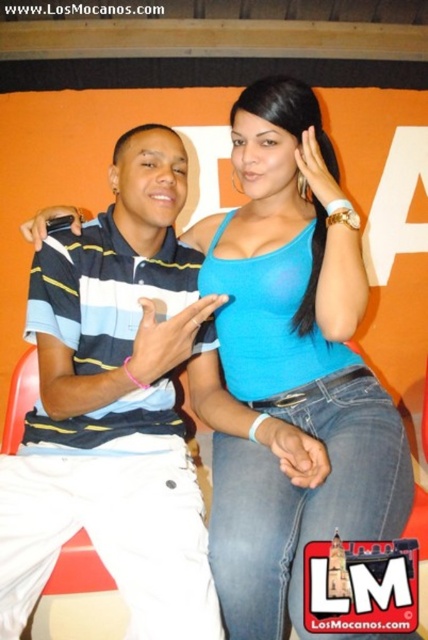
You are standing in front of the image and want to identify the position of the striped cotton polo shirt at center. Based on the coordinates provided, can you determine if it is positioned more to the left or right side of the image?

The striped cotton polo shirt at center is located at coordinates point (115, 406). Since the x coordinate is 0.636 which is closer to 1.0, it is positioned more to the right side of the image.

You are taking a photo of two people wearing striped cotton polo shirt at center and blue matte tank top at center. Which one is positioned to the left?

The striped cotton polo shirt at center is positioned to the left of the blue matte tank top at center.

You are a fashion designer who needs to create a new line of clothing. You observe the striped cotton polo shirt at center and the blue matte tank top at center in the image. Which clothing item is narrower in width?

The striped cotton polo shirt at center has a lesser width compared to the blue matte tank top at center, so the striped cotton polo shirt at center is narrower in width.